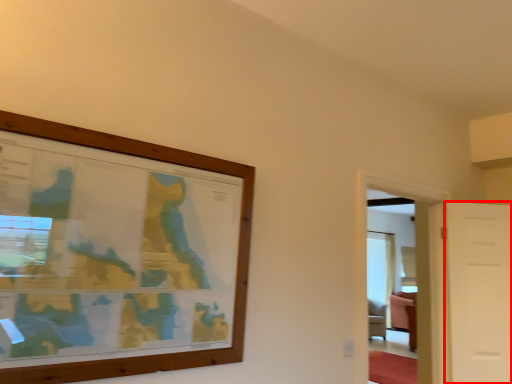
Question: Considering the relative positions of door (annotated by the red box) and glass door in the image provided, where is door (annotated by the red box) located with respect to the staircase?

Choices:
 (A) left
 (B) right

Answer: (B)